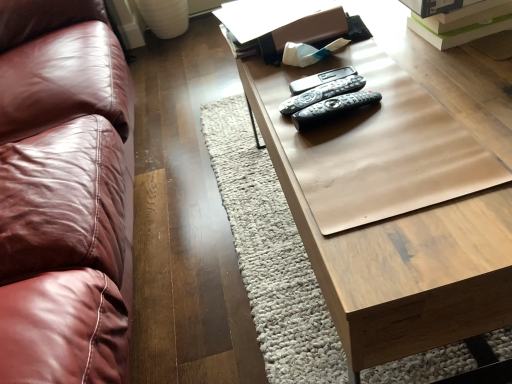
Locate an element on the screen. This screenshot has width=512, height=384. vacant region in front of black plastic remotes at center, which appears as the first remote when viewed from the front is located at coordinates (377, 167).